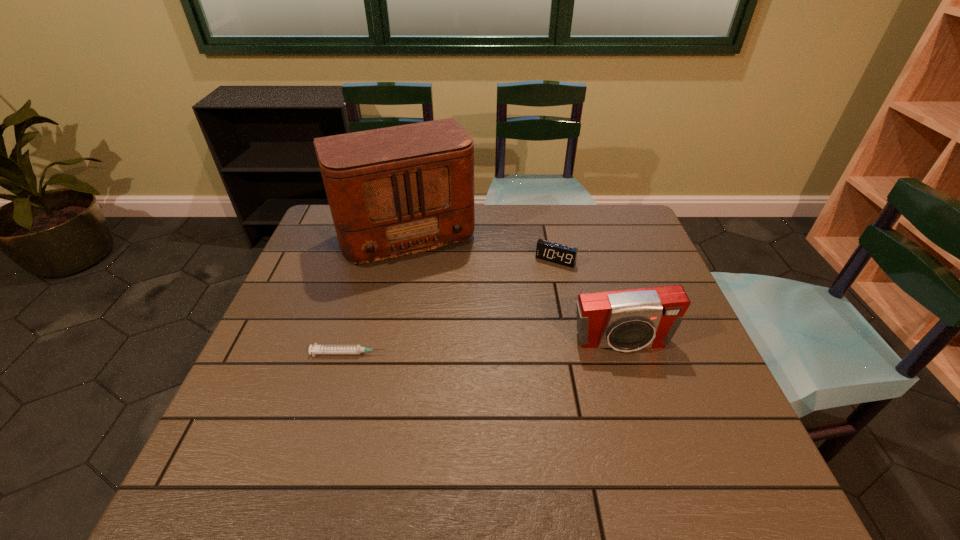
This screenshot has height=540, width=960. Find the location of `blank area located 0.170m on the front panel of the tallest object`. blank area located 0.170m on the front panel of the tallest object is located at coordinates (441, 308).

The image size is (960, 540). I want to click on vacant region located on the front panel of the tallest object, so pyautogui.click(x=457, y=343).

This screenshot has height=540, width=960. Find the location of `object present at the far edge`. object present at the far edge is located at coordinates (395, 191).

Identify the location of syringe that is at the left edge. The height and width of the screenshot is (540, 960). (316, 349).

What are the coordinates of `radio receiver that is at the left edge` in the screenshot? It's located at (395, 191).

Where is `object at the right edge`? The width and height of the screenshot is (960, 540). object at the right edge is located at coordinates (626, 320).

Identify the location of object situated at the far left corner. This screenshot has height=540, width=960. (395, 191).

The image size is (960, 540). Find the location of `vacant region at the far edge of the desktop`. vacant region at the far edge of the desktop is located at coordinates (567, 214).

Image resolution: width=960 pixels, height=540 pixels. What are the coordinates of `free region at the near edge of the desktop` in the screenshot? It's located at (516, 425).

In order to click on free space at the left edge of the desktop in this screenshot , I will do `click(335, 264)`.